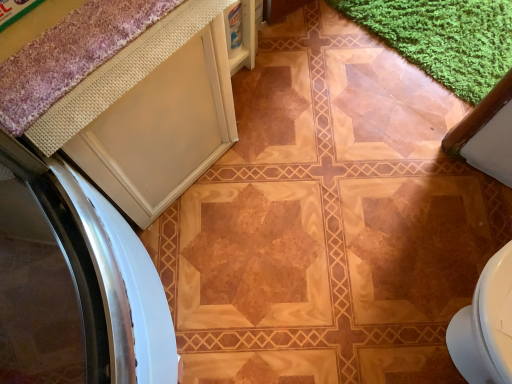
What do you see at coordinates (70, 56) in the screenshot? I see `purple textured bath mat at upper left` at bounding box center [70, 56].

The width and height of the screenshot is (512, 384). In order to click on purple textured bath mat at upper left in this screenshot , I will do `click(70, 56)`.

Describe the element at coordinates (168, 124) in the screenshot. I see `white matte cabinet at upper left` at that location.

Measure the distance between point [132,136] and camera.

The depth of point [132,136] is 34.29 inches.

Locate an element on the screen. white matte cabinet at upper left is located at coordinates (168, 124).

The width and height of the screenshot is (512, 384). I want to click on purple textured bath mat at upper left, so click(70, 56).

Considering the positions of objects white matte cabinet at upper left and purple textured bath mat at upper left in the image provided, who is more to the left, white matte cabinet at upper left or purple textured bath mat at upper left?

white matte cabinet at upper left.

Is white matte cabinet at upper left further to the viewer compared to purple textured bath mat at upper left?

Yes, white matte cabinet at upper left is further from the viewer.

Which is behind, point (106, 176) or point (95, 49)?

Positioned behind is point (106, 176).

From the image's perspective, is white matte cabinet at upper left above or below purple textured bath mat at upper left?

Clearly, from the image's perspective, white matte cabinet at upper left is below purple textured bath mat at upper left.

From a real-world perspective, is white matte cabinet at upper left positioned under purple textured bath mat at upper left based on gravity?

Yes, from a real-world perspective, white matte cabinet at upper left is beneath purple textured bath mat at upper left.

Does white matte cabinet at upper left have a greater width compared to purple textured bath mat at upper left?

Correct, the width of white matte cabinet at upper left exceeds that of purple textured bath mat at upper left.

From the picture: Who is taller, white matte cabinet at upper left or purple textured bath mat at upper left?

white matte cabinet at upper left.

Who is smaller, white matte cabinet at upper left or purple textured bath mat at upper left?

With smaller size is purple textured bath mat at upper left.

Is white matte cabinet at upper left inside the boundaries of purple textured bath mat at upper left, or outside?

white matte cabinet at upper left is not inside purple textured bath mat at upper left, it's outside.

Is white matte cabinet at upper left far away from purple textured bath mat at upper left?

They are positioned close to each other.

Could you tell me if white matte cabinet at upper left is facing purple textured bath mat at upper left?

No, white matte cabinet at upper left is not aimed at purple textured bath mat at upper left.

How different are the orientations of white matte cabinet at upper left and purple textured bath mat at upper left in degrees?

They differ by 0.142 degrees in their facing directions.

Where is `bath mat positioned vertically above the white matte cabinet at upper left (from a real-world perspective)`? The height and width of the screenshot is (384, 512). bath mat positioned vertically above the white matte cabinet at upper left (from a real-world perspective) is located at coordinates (70, 56).

Is purple textured bath mat at upper left at the right side of white matte cabinet at upper left?

Correct, you'll find purple textured bath mat at upper left to the right of white matte cabinet at upper left.

Does purple textured bath mat at upper left lie in front of white matte cabinet at upper left?

Yes, purple textured bath mat at upper left is closer to the viewer.

Is point (124, 11) closer or farther from the camera than point (118, 167)?

Point (124, 11) is closer to the camera than point (118, 167).

From the image's perspective, which one is positioned lower, purple textured bath mat at upper left or white matte cabinet at upper left?

white matte cabinet at upper left is shown below in the image.

Based on the photo, from a real-world perspective, between purple textured bath mat at upper left and white matte cabinet at upper left, who is vertically lower?

white matte cabinet at upper left is physically lower.

Considering the sizes of objects purple textured bath mat at upper left and white matte cabinet at upper left in the image provided, who is wider, purple textured bath mat at upper left or white matte cabinet at upper left?

With larger width is white matte cabinet at upper left.

Can you confirm if purple textured bath mat at upper left is shorter than white matte cabinet at upper left?

Correct, purple textured bath mat at upper left is not as tall as white matte cabinet at upper left.

Looking at this image, who is smaller, purple textured bath mat at upper left or white matte cabinet at upper left?

Smaller between the two is purple textured bath mat at upper left.

Is purple textured bath mat at upper left not inside white matte cabinet at upper left?

Yes.

In the scene shown: Is purple textured bath mat at upper left beside white matte cabinet at upper left?

purple textured bath mat at upper left and white matte cabinet at upper left are not in contact.

Is white matte cabinet at upper left at the back of purple textured bath mat at upper left?

No, white matte cabinet at upper left is not at the back of purple textured bath mat at upper left.

The width and height of the screenshot is (512, 384). Identify the location of bath mat on the right side of white matte cabinet at upper left. (70, 56).

I want to click on cabinetry below the purple textured bath mat at upper left (from the image's perspective), so click(x=168, y=124).

The width and height of the screenshot is (512, 384). I want to click on cabinetry that is behind the purple textured bath mat at upper left, so click(168, 124).